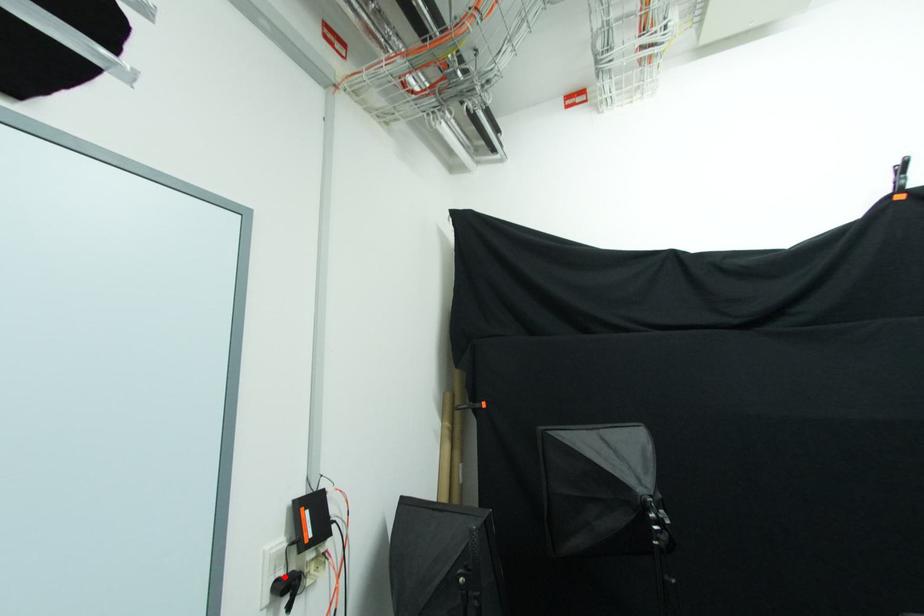
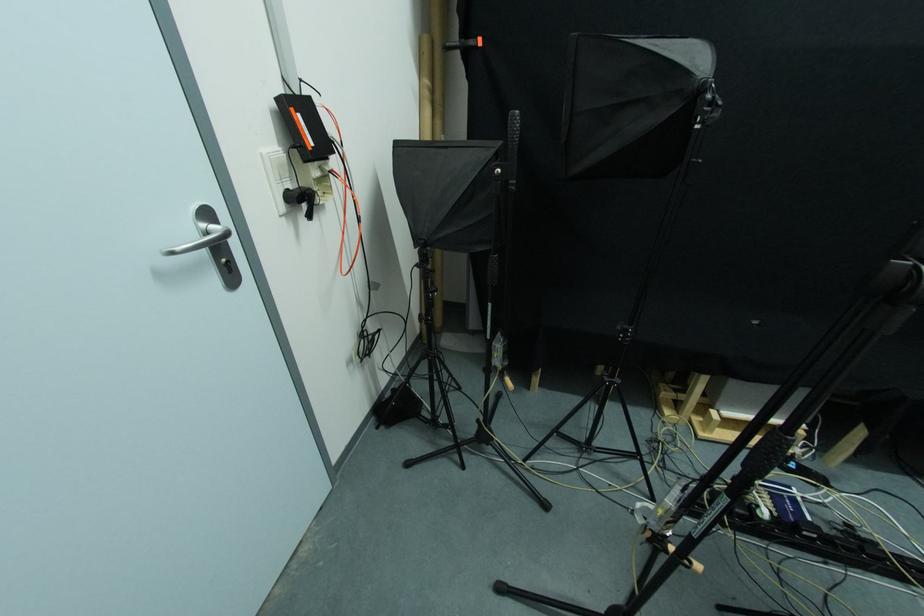
Find the pixel in the second image that matches the highlighted location in the first image.

(292, 188)